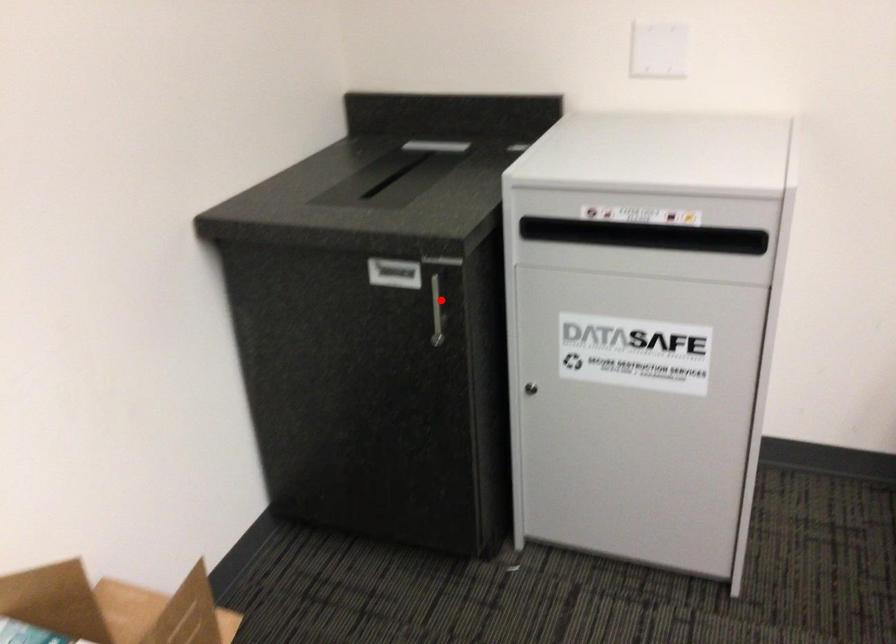
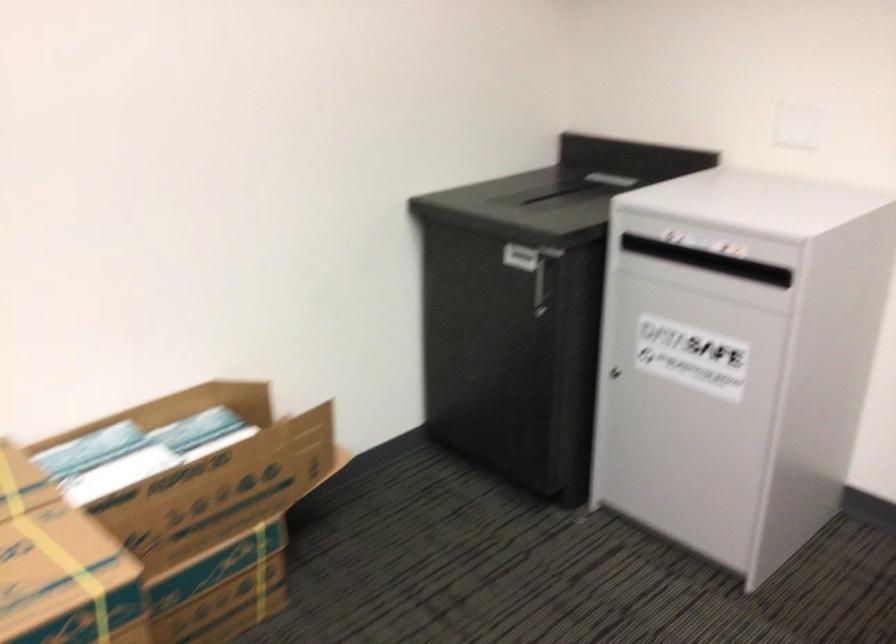
Locate, in the second image, the point that corresponds to the highlighted location in the first image.

(541, 281)